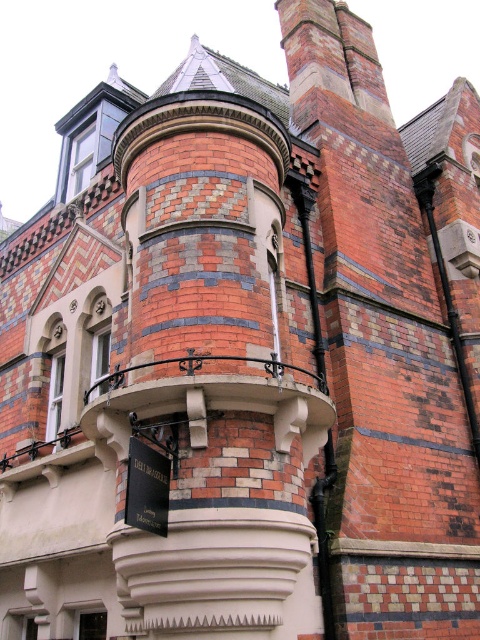
From the picture: You are standing in front of the Victorian building and notice the black matte sign at lower center and the white plastic clock at upper center. Which object is nearer to you?

The black matte sign at lower center is closer to the viewer than the white plastic clock at upper center.

You are standing in front of the Victorian building and want to locate the black matte sign at lower center. Based on the coordinates provided, where should you look relative to the bay window?

The black matte sign at lower center is located at coordinates point (146,488), which places it to the right and slightly below the bay window in the scene.